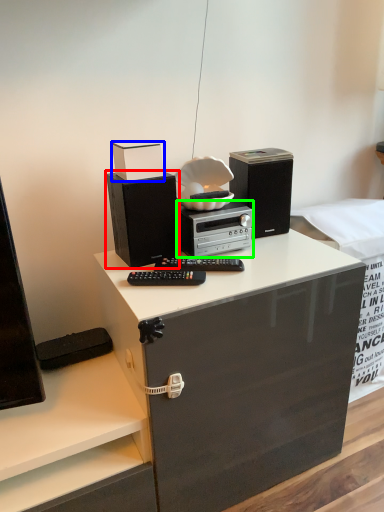
Question: Based on their relative distances, which object is farther from speaker (highlighted by a red box)? Choose from box (highlighted by a blue box) and home appliance (highlighted by a green box).

Choices:
 (A) box
 (B) home appliance

Answer: (A)